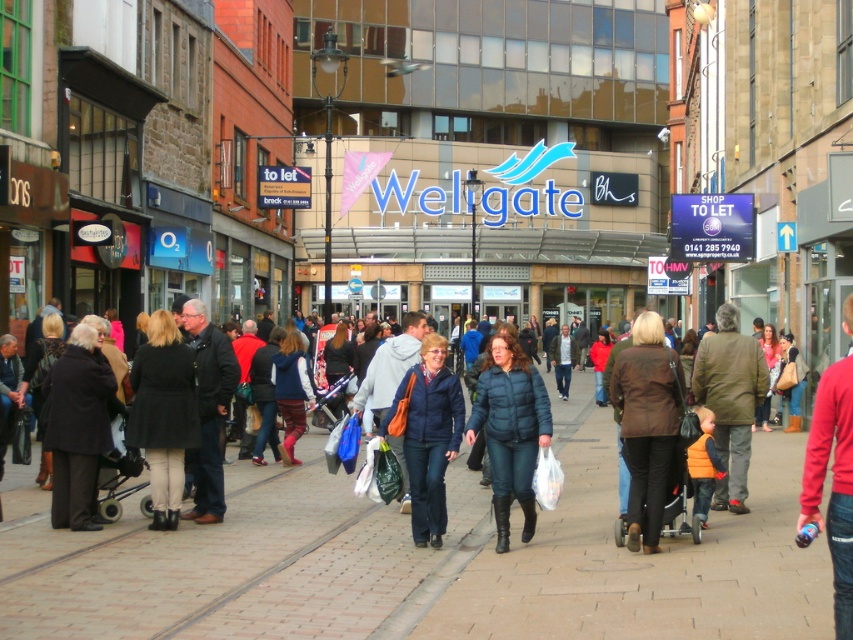
You are a delivery person standing at the point marked by the coordinates point (x=509, y=429). Looking around, you see a dark blue puffer jacket at center. What is the nearest object to your current position?

The nearest object to your current position is the dark blue puffer jacket at center, as the point (x=509, y=429) is located on it.

You are a fashion buyer looking to purchase jackets for a store. You see two jackets in the image, the dark blue puffer jacket at center and the matte blue jacket at center. Which jacket has a slimmer profile when viewed from the front?

The dark blue puffer jacket at center is thinner than the matte blue jacket at center, so it has a slimmer profile when viewed from the front.